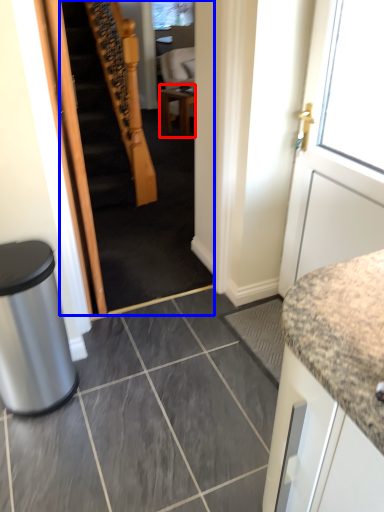
Question: Which object is closer to the camera taking this photo, table (highlighted by a red box) or stairwell (highlighted by a blue box)?

Choices:
 (A) table
 (B) stairwell

Answer: (B)